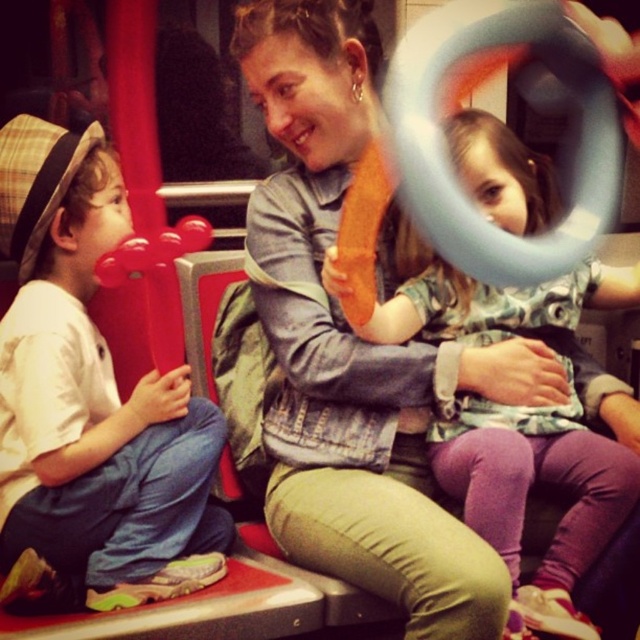
Who is shorter, matte red balloon at left or matte orange balloon at center?

Standing shorter between the two is matte red balloon at left.

Looking at this image, does matte red balloon at left have a greater height compared to matte orange balloon at center?

No, matte red balloon at left is not taller than matte orange balloon at center.

You are a GUI agent. You are given a task and a screenshot of the screen. Output one action in this format:
    pyautogui.click(x=<x>, y=<y>)
    Task: Click on the matte red balloon at left
    
    Given the screenshot: What is the action you would take?
    pyautogui.click(x=90, y=403)